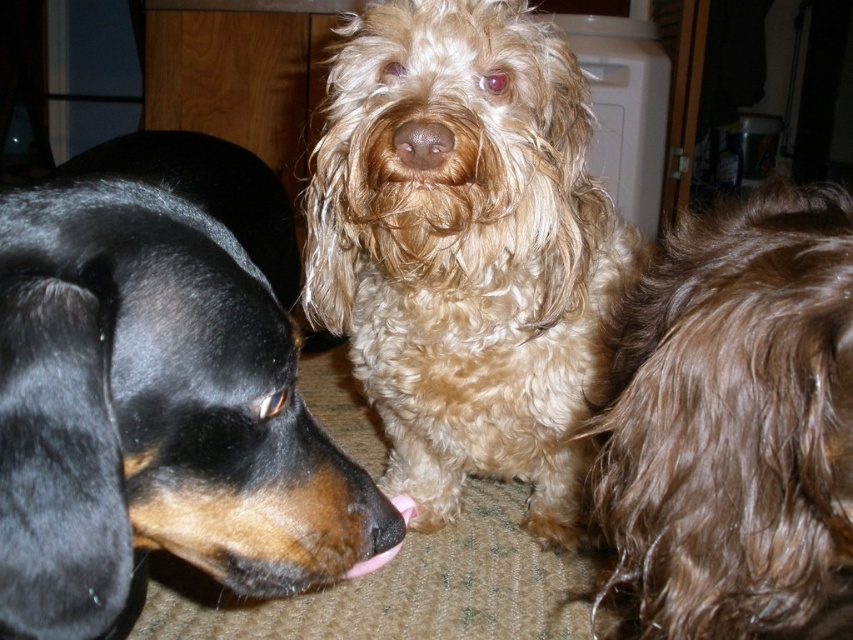
Does black shiny coat at left have a lesser height compared to brown curly fur at right?

Indeed, black shiny coat at left has a lesser height compared to brown curly fur at right.

Can you confirm if black shiny coat at left is wider than brown curly fur at right?

Yes, black shiny coat at left is wider than brown curly fur at right.

Between point (149, 540) and point (677, 260), which one is positioned behind?

Point (677, 260)

What are the coordinates of `black shiny coat at left` in the screenshot? It's located at [160, 390].

Does brown curly fur at right appear on the right side of brown furry nose at center?

Correct, you'll find brown curly fur at right to the right of brown furry nose at center.

Find the location of `brown curly fur at right`. brown curly fur at right is located at coordinates coord(735,424).

At what (x,y) coordinates should I click in order to perform the action: click on brown curly fur at right. Please return your answer as a coordinate pair (x, y). The width and height of the screenshot is (853, 640). Looking at the image, I should click on (735, 424).

Can you confirm if fuzzy golden dog at center is positioned to the left of brown curly fur at right?

Yes, fuzzy golden dog at center is to the left of brown curly fur at right.

Does fuzzy golden dog at center have a greater width compared to brown curly fur at right?

Correct, the width of fuzzy golden dog at center exceeds that of brown curly fur at right.

Who is more forward, (350, 141) or (722, 212)?

Point (722, 212) is in front.

Where is `fuzzy golden dog at center`? The height and width of the screenshot is (640, 853). fuzzy golden dog at center is located at coordinates (465, 250).